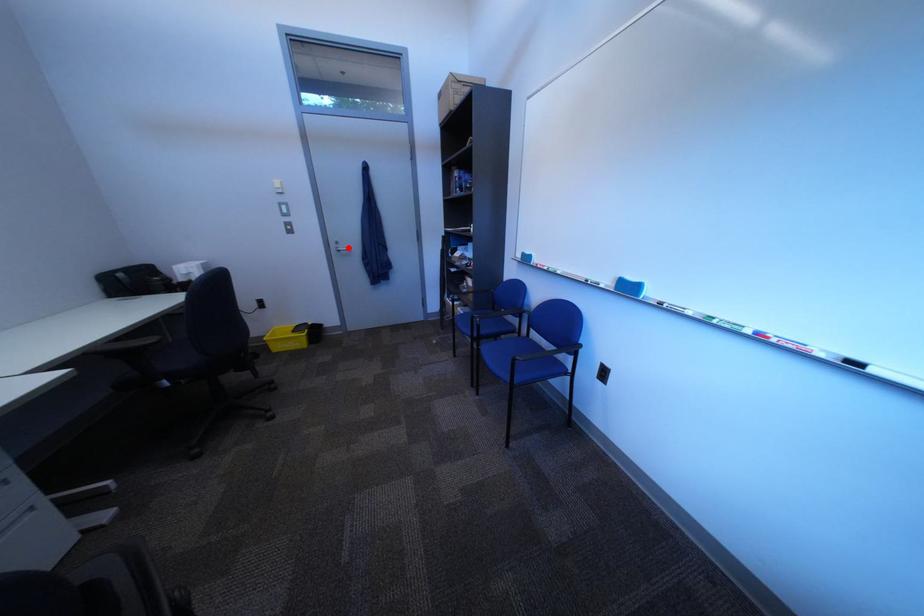
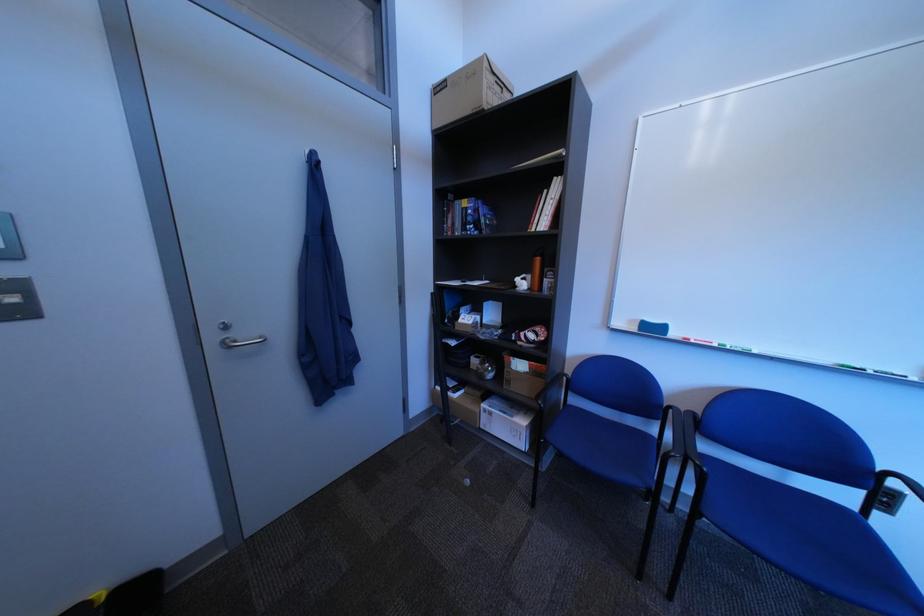
Question: I am providing you with two images of the same scene from different viewpoints. Image1 has a red point marked. In image2, the corresponding 3D location appears at what relative position? Reply with the corresponding letter.

Choices:
 (A) Closer
 (B) Farther

Answer: (B)